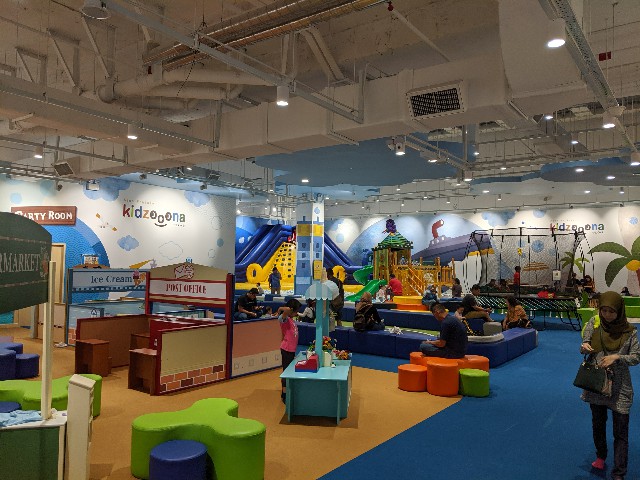
The width and height of the screenshot is (640, 480). Identify the location of wooden floor. (342, 448).